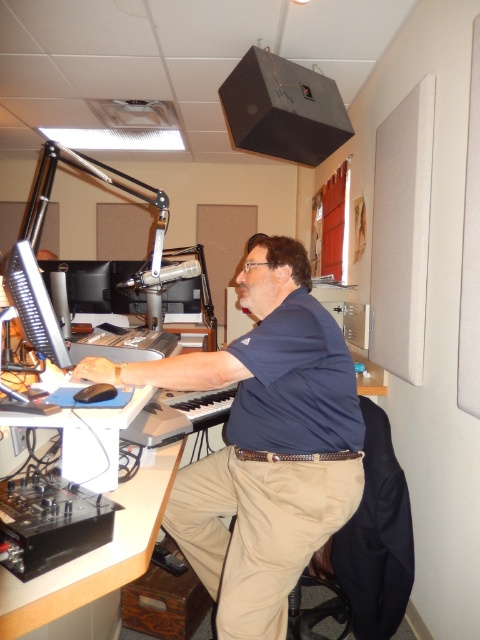
What do you see at coordinates (364, 548) in the screenshot? I see `black mesh swivel chair at lower right` at bounding box center [364, 548].

Between black mesh swivel chair at lower right and matte black monitor at left, which one has less height?

With less height is matte black monitor at left.

The width and height of the screenshot is (480, 640). Describe the element at coordinates (364, 548) in the screenshot. I see `black mesh swivel chair at lower right` at that location.

At what (x,y) coordinates should I click in order to perform the action: click on black mesh swivel chair at lower right. Please return your answer as a coordinate pair (x, y). Image resolution: width=480 pixels, height=640 pixels. Looking at the image, I should click on (364, 548).

Who is positioned more to the right, black mesh swivel chair at lower right or white plastic computer desk at lower left?

black mesh swivel chair at lower right

Which is in front, point (367, 444) or point (132, 573)?

Point (132, 573) is in front.

This screenshot has width=480, height=640. I want to click on black mesh swivel chair at lower right, so click(x=364, y=548).

Is point (328, 328) positioned after point (39, 616)?

Yes, point (328, 328) is behind point (39, 616).

Does dark blue shirt at center appear on the left side of white plastic computer desk at lower left?

Incorrect, dark blue shirt at center is not on the left side of white plastic computer desk at lower left.

Who is more distant from viewer, (239, 428) or (139, 477)?

The point (239, 428) is behind.

I want to click on dark blue shirt at center, so click(x=264, y=444).